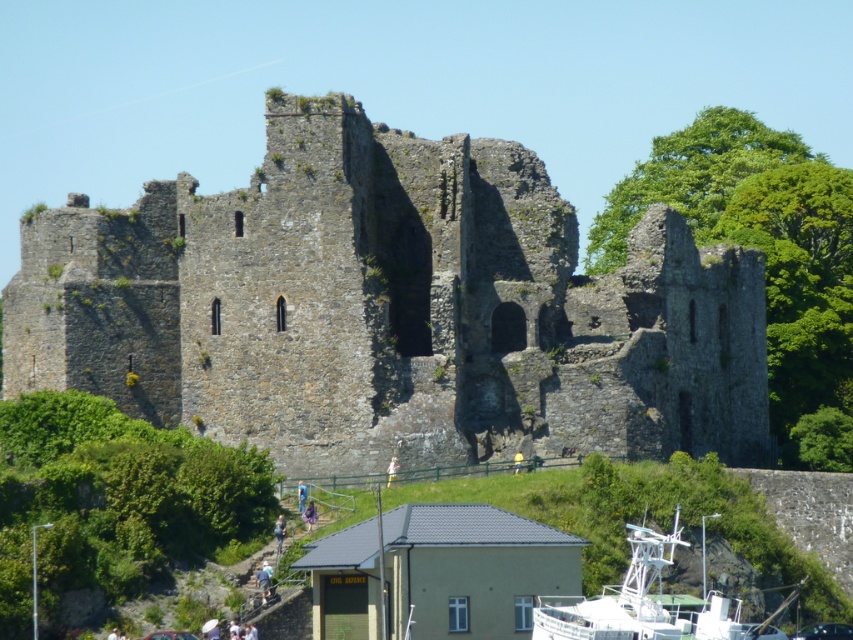
Question: Does rusty stone castle at center have a larger size compared to white plastic boat at lower center?

Choices:
 (A) no
 (B) yes

Answer: (B)

Question: Among these objects, which one is nearest to the camera?

Choices:
 (A) rusty stone castle at center
 (B) white plastic boat at lower center

Answer: (B)

Question: Among these objects, which one is farthest from the camera?

Choices:
 (A) rusty stone castle at center
 (B) white plastic boat at lower center

Answer: (A)

Question: Which point appears farthest from the camera in this image?

Choices:
 (A) (723, 604)
 (B) (125, 227)

Answer: (B)

Question: Is rusty stone castle at center positioned before white plastic boat at lower center?

Choices:
 (A) no
 (B) yes

Answer: (A)

Question: Considering the relative positions of rusty stone castle at center and white plastic boat at lower center in the image provided, where is rusty stone castle at center located with respect to white plastic boat at lower center?

Choices:
 (A) right
 (B) left

Answer: (B)